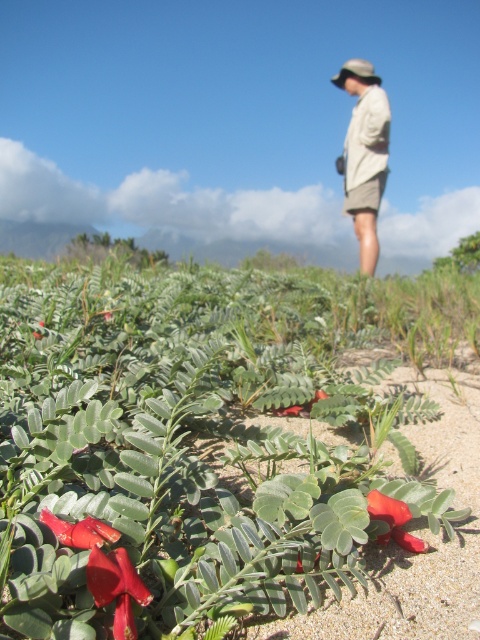
You are standing at the point labeled point (152, 321) and want to walk towards the person in the background. Will you pass by point (333, 76) on your way?

No, because point (152, 321) is closer to the viewer than point (333, 76), so walking towards the person in the background would move you away from point (333, 76) rather than towards it.